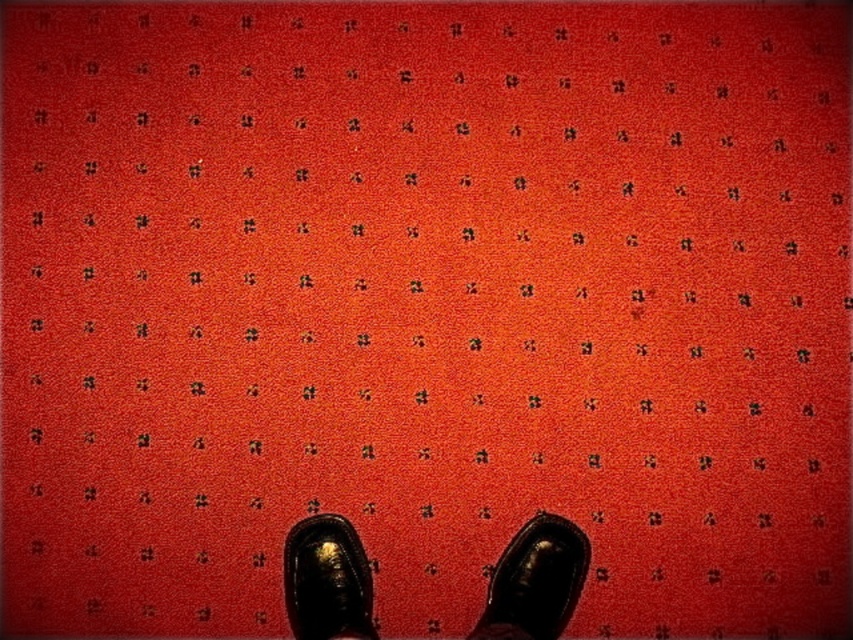
Does point (361, 593) come in front of point (558, 554)?

Yes, it is.

Does point (310, 532) come closer to viewer compared to point (527, 620)?

No, it is not.

Locate an element on the screen. This screenshot has height=640, width=853. shiny black shoes at center is located at coordinates (535, 580).

Which is in front, point (488, 593) or point (309, 588)?

Point (309, 588)

Is shiny black shoe at center smaller than shiny black shoe at lower center?

Incorrect, shiny black shoe at center is not smaller in size than shiny black shoe at lower center.

This screenshot has width=853, height=640. Describe the element at coordinates (535, 580) in the screenshot. I see `shiny black shoe at center` at that location.

You are a GUI agent. You are given a task and a screenshot of the screen. Output one action in this format:
    pyautogui.click(x=<x>, y=<y>)
    Task: Click on the shiny black shoe at center
    The width and height of the screenshot is (853, 640).
    Given the screenshot: What is the action you would take?
    pyautogui.click(x=535, y=580)

Does shiny black shoes at center have a lesser height compared to shiny black shoe at lower center?

Correct, shiny black shoes at center is not as tall as shiny black shoe at lower center.

Identify the location of shiny black shoes at center. The width and height of the screenshot is (853, 640). (535, 580).